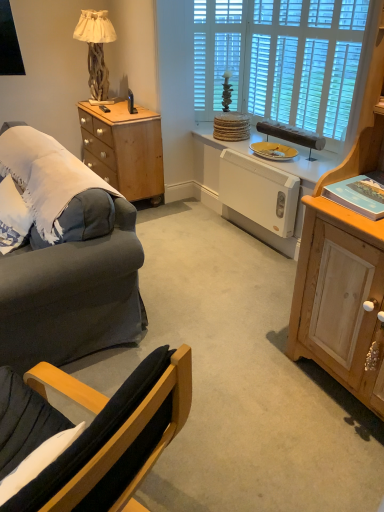
Question: Considering the relative sizes of yellow matte plate at center and natural wood lamp at upper left in the image provided, is yellow matte plate at center shorter than natural wood lamp at upper left?

Choices:
 (A) no
 (B) yes

Answer: (B)

Question: Does yellow matte plate at center come behind natural wood lamp at upper left?

Choices:
 (A) yes
 (B) no

Answer: (B)

Question: Could you tell me if yellow matte plate at center is turned towards natural wood lamp at upper left?

Choices:
 (A) yes
 (B) no

Answer: (B)

Question: Is natural wood lamp at upper left completely or partially inside yellow matte plate at center?

Choices:
 (A) yes
 (B) no

Answer: (B)

Question: Are yellow matte plate at center and natural wood lamp at upper left far apart?

Choices:
 (A) yes
 (B) no

Answer: (A)

Question: Would you say yellow matte plate at center is inside or outside white plastic heater at center?

Choices:
 (A) inside
 (B) outside

Answer: (B)

Question: From the image's perspective, is yellow matte plate at center above or below white plastic heater at center?

Choices:
 (A) below
 (B) above

Answer: (B)

Question: Considering the positions of point (256, 147) and point (286, 184), is point (256, 147) closer or farther from the camera than point (286, 184)?

Choices:
 (A) closer
 (B) farther

Answer: (B)

Question: Looking at the image, does yellow matte plate at center seem bigger or smaller compared to white plastic heater at center?

Choices:
 (A) small
 (B) big

Answer: (A)

Question: From the image's perspective, relative to light wood cabinet at right, is yellow matte plate at center above or below?

Choices:
 (A) below
 (B) above

Answer: (B)

Question: Is point (258, 145) closer or farther from the camera than point (354, 296)?

Choices:
 (A) farther
 (B) closer

Answer: (A)

Question: From a real-world perspective, relative to light wood cabinet at right, is yellow matte plate at center vertically above or below?

Choices:
 (A) above
 (B) below

Answer: (B)

Question: Is yellow matte plate at center wider or thinner than light wood cabinet at right?

Choices:
 (A) wide
 (B) thin

Answer: (B)

Question: Is light wood/texture side table at left bigger or smaller than black plastic remote control at upper left?

Choices:
 (A) big
 (B) small

Answer: (A)

Question: Would you say light wood/texture side table at left is to the left or to the right of black plastic remote control at upper left in the picture?

Choices:
 (A) left
 (B) right

Answer: (B)